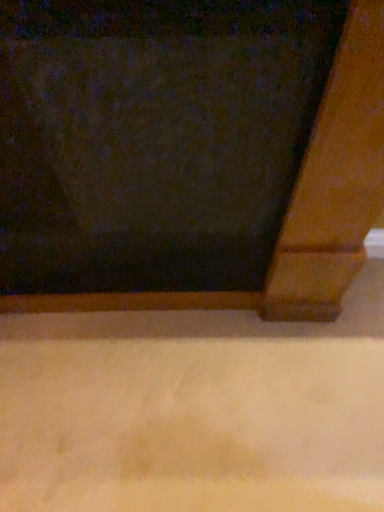
Question: Should I look upward or downward to see matte wood frame at lower right?

Choices:
 (A) up
 (B) down

Answer: (A)